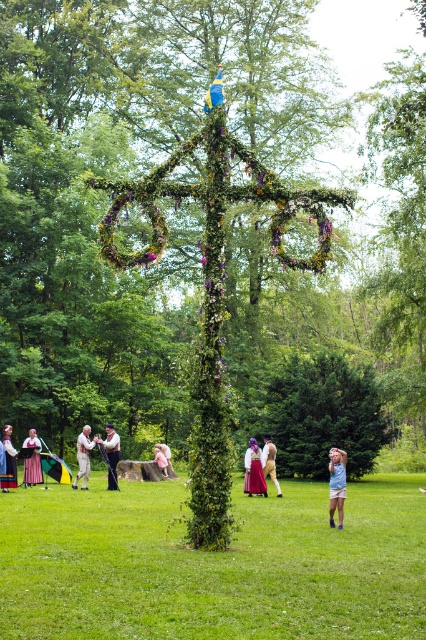
Is green grass at center smaller than white cotton shirt at center?

No.

Does point (166, 632) come farther from viewer compared to point (109, 442)?

No, (166, 632) is in front of (109, 442).

The height and width of the screenshot is (640, 426). In order to click on green grass at center in this screenshot , I will do `click(213, 564)`.

Between light brown leather jacket at center and white cotton shirt at center, which one has less height?

light brown leather jacket at center is shorter.

What do you see at coordinates (83, 456) in the screenshot?
I see `light brown leather jacket at center` at bounding box center [83, 456].

This screenshot has height=640, width=426. What are the coordinates of `light brown leather jacket at center` in the screenshot? It's located at (83, 456).

Is green grass at center thinner than matte pink dress at lower left?

No, green grass at center is not thinner than matte pink dress at lower left.

Is green grass at center positioned before matte pink dress at lower left?

Yes.

Identify the location of green grass at center. Image resolution: width=426 pixels, height=640 pixels. (213, 564).